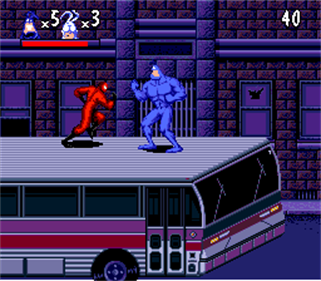
This screenshot has width=321, height=281. I want to click on windows, so click(123, 201), click(68, 197), click(17, 199).